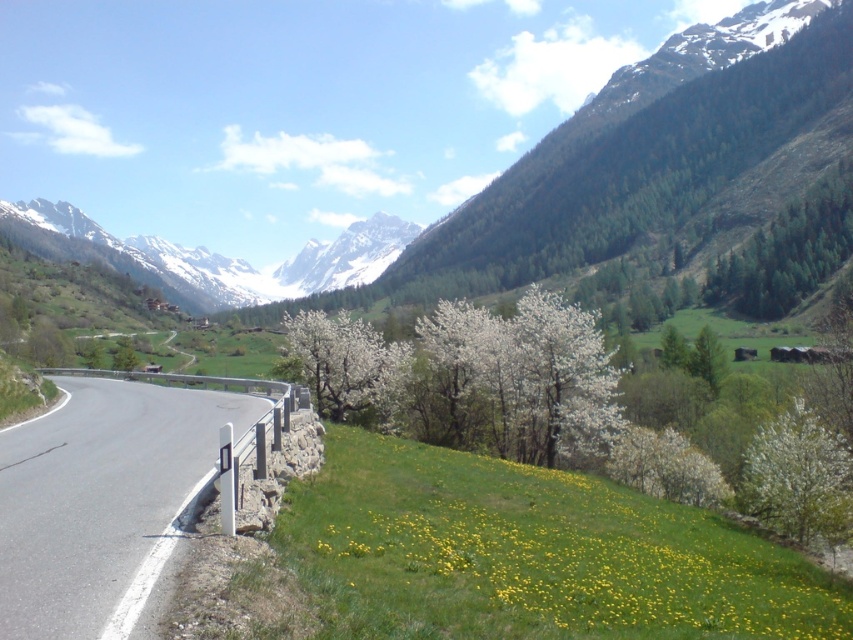
You are a hiker planning to take a photo of the yellow grass at lower right and the green forested mountain at upper center. Which of the two objects will appear narrower in your photo?

The yellow grass at lower right will appear narrower in the photo because its width is less than the green forested mountain at upper center.

You are a hiker standing at the starting point of the road. You see the yellow grass at lower right and the green forested mountain at upper center. Which object is closer to you?

The yellow grass at lower right is closer to you because it is in front of the green forested mountain at upper center.